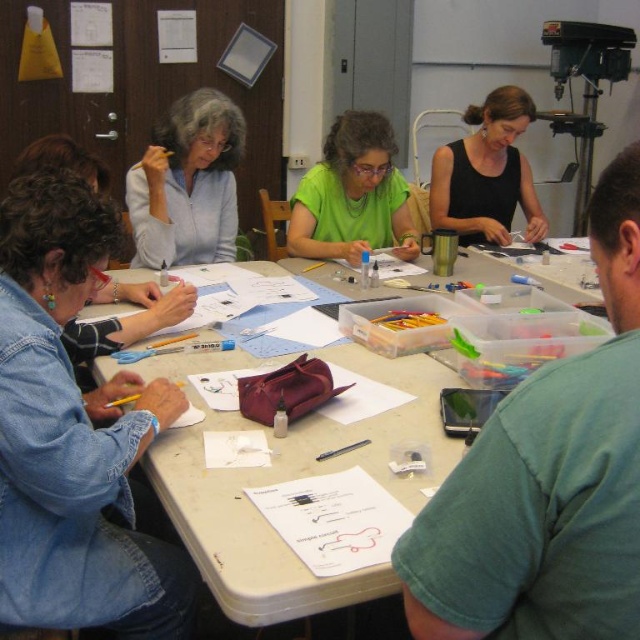
Which is behind, point (189, 442) or point (538, 205)?

Point (538, 205)

Find the location of a particular element. Image resolution: width=640 pixels, height=640 pixels. white plastic table at center is located at coordinates (288, 477).

Does black matte phone at upper center have a greater height compared to white plastic table at center?

Yes.

Between point (618, 184) and point (189, 392), which one is positioned in front?

Point (618, 184) is in front.

Who is more forward, (x=531, y=552) or (x=182, y=364)?

Positioned in front is point (x=531, y=552).

Image resolution: width=640 pixels, height=640 pixels. I want to click on black matte phone at upper center, so click(547, 481).

How much distance is there between white paper at center and metallic silver scissors at center?

The distance of white paper at center from metallic silver scissors at center is 28.04 inches.

Where is `white paper at center`? Image resolution: width=640 pixels, height=640 pixels. white paper at center is located at coordinates (333, 518).